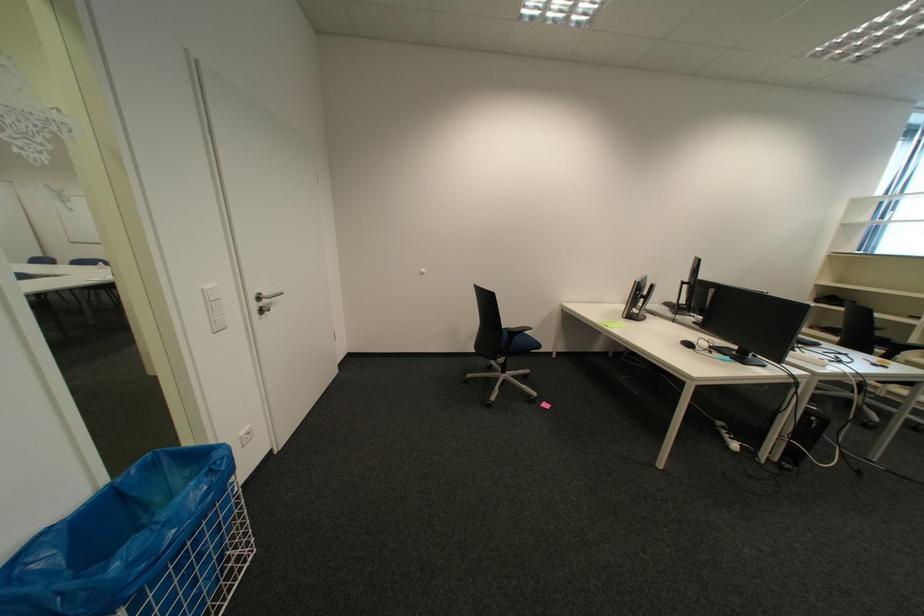
The location [612,323] corresponds to which object?

It corresponds to the yellow sticky note in the image.